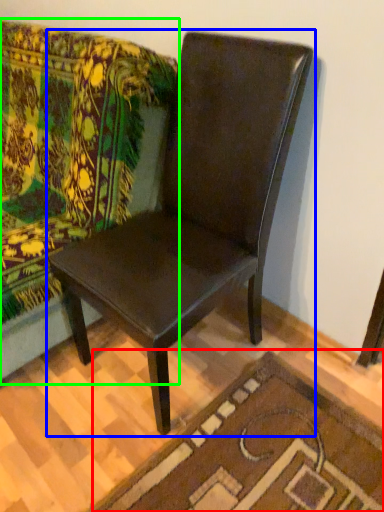
Question: Which object is the closest to the doormat (highlighted by a red box)? Choose among these: chair (highlighted by a blue box) or studio couch (highlighted by a green box).

Choices:
 (A) chair
 (B) studio couch

Answer: (A)